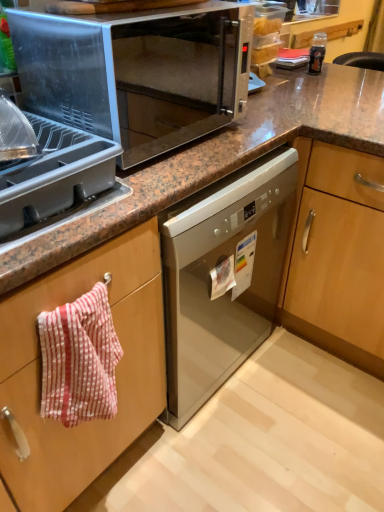
Question: Is red striped towel at left to the left or to the right of satin silver microwave at upper center in the image?

Choices:
 (A) right
 (B) left

Answer: (B)

Question: Is red striped towel at left bigger or smaller than satin silver microwave at upper center?

Choices:
 (A) small
 (B) big

Answer: (A)

Question: Based on their relative distances, which object is nearer to the satin silver microwave at upper center?

Choices:
 (A) gray plastic tray at upper left
 (B) red striped towel at left

Answer: (A)

Question: Considering the real-world distances, which object is closest to the satin silver microwave at upper center?

Choices:
 (A) red striped towel at left
 (B) gray plastic tray at upper left

Answer: (B)